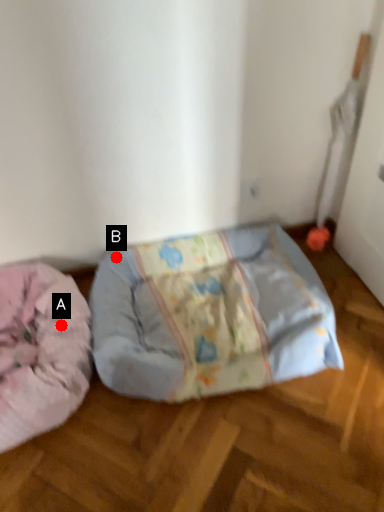
Question: Two points are circled on the image, labeled by A and B beside each circle. Which of the following is the closest to the observer?

Choices:
 (A) A is closer
 (B) B is closer

Answer: (A)